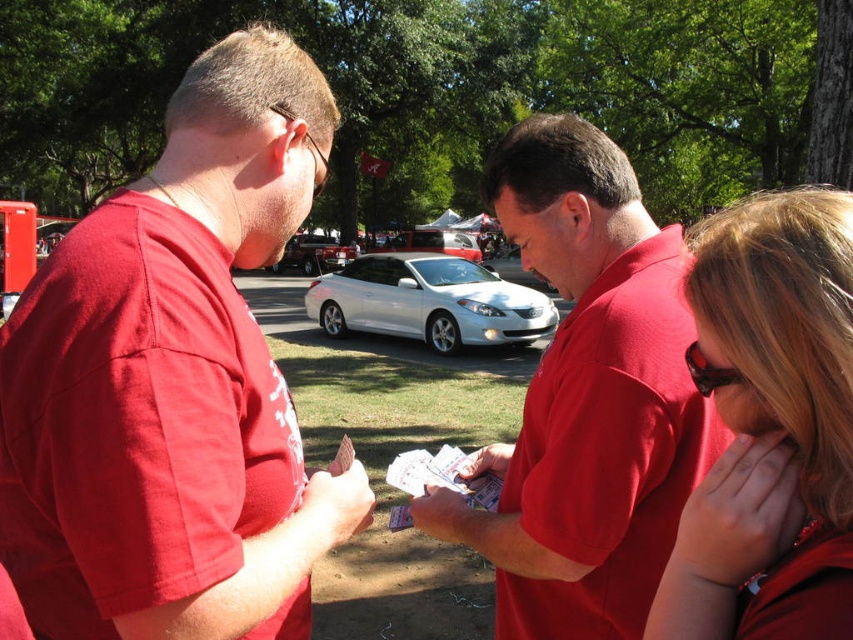
You are at an outdoor event and need to locate the tallest object between the matte red shirt at center and the silver metallic car at center. Which one should you look for?

The matte red shirt at center is taller than the silver metallic car at center, so you should look for the matte red shirt at center.

You are standing at the point with coordinates [587,397] in the image. What object is located exactly at this point?

The point at coordinates [587,397] is exactly where the matte red shirt at center is located.